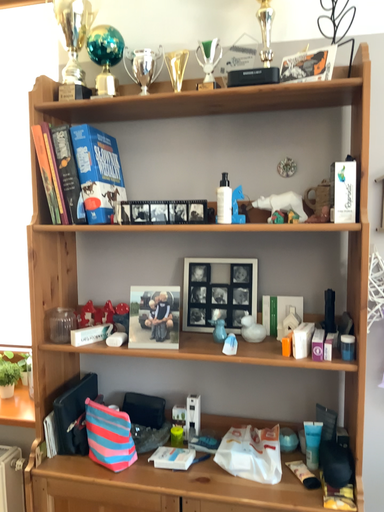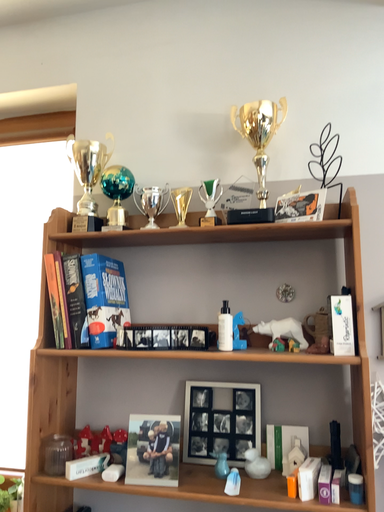
Question: Which way did the camera rotate in the video?

Choices:
 (A) rotated upward
 (B) rotated downward

Answer: (A)